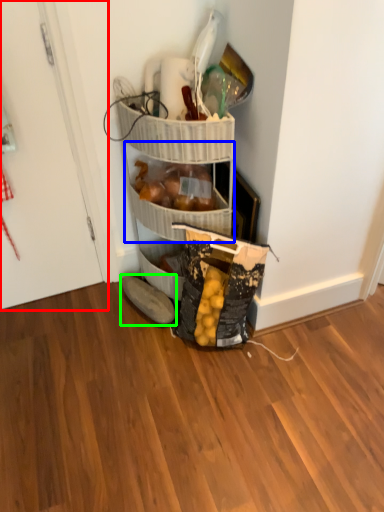
Question: Considering the real-world distances, which object is farthest from door (highlighted by a red box)? basket (highlighted by a blue box) or footwear (highlighted by a green box)?

Choices:
 (A) basket
 (B) footwear

Answer: (B)